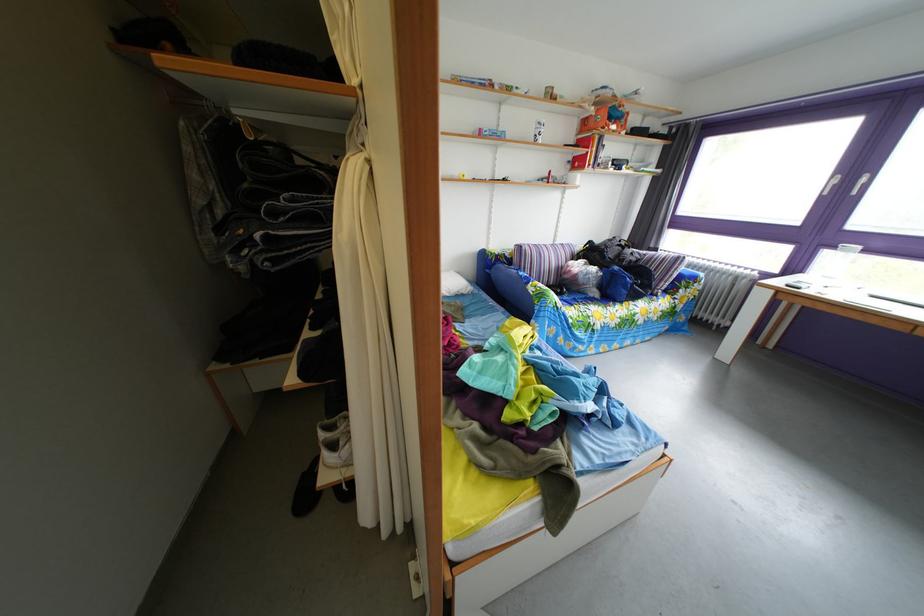
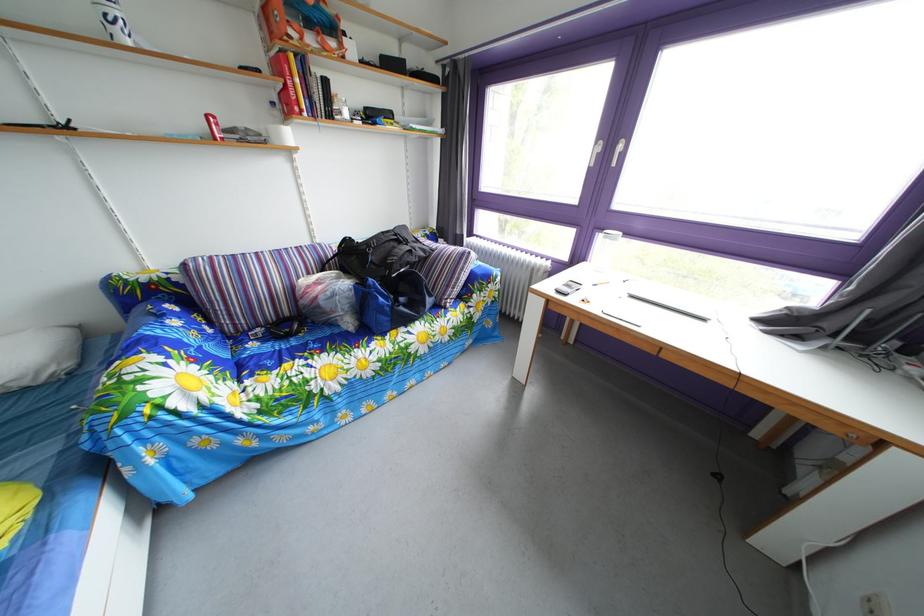
Locate, in the second image, the point that corresponds to [812,280] in the first image.

(594, 268)